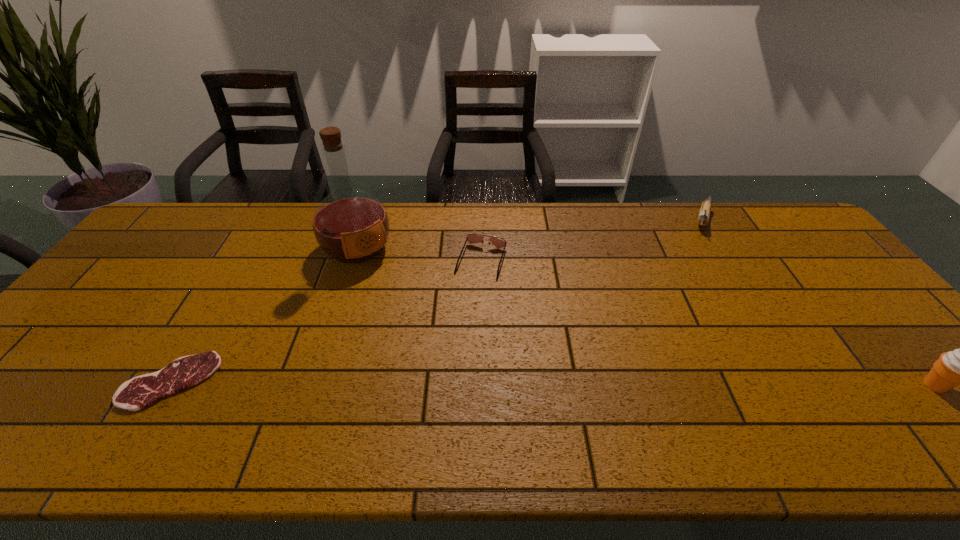
Identify the location of banana that is at the far edge. (703, 218).

The image size is (960, 540). I want to click on object that is at the near edge, so click(x=141, y=391).

In the image, there is a desktop. Where is `vacant space at the far edge`? vacant space at the far edge is located at coordinates (674, 229).

In the image, there is a desktop. What are the coordinates of `vacant space at the right edge` in the screenshot? It's located at (885, 343).

What are the coordinates of `vacant space at the far left corner of the desktop` in the screenshot? It's located at (196, 224).

This screenshot has width=960, height=540. I want to click on vacant space at the near left corner of the desktop, so click(9, 404).

Identify the location of free space between the second object from left to right and the leftmost object. The image size is (960, 540). (264, 315).

Locate an element on the screen. This screenshot has width=960, height=540. empty space that is in between the third tallest object and the shortest object is located at coordinates (436, 300).

What are the coordinates of `vacant region between the steak and the banana` in the screenshot? It's located at (436, 300).

What are the coordinates of `empty space between the liquor and the fourth tallest object` in the screenshot? It's located at (420, 255).